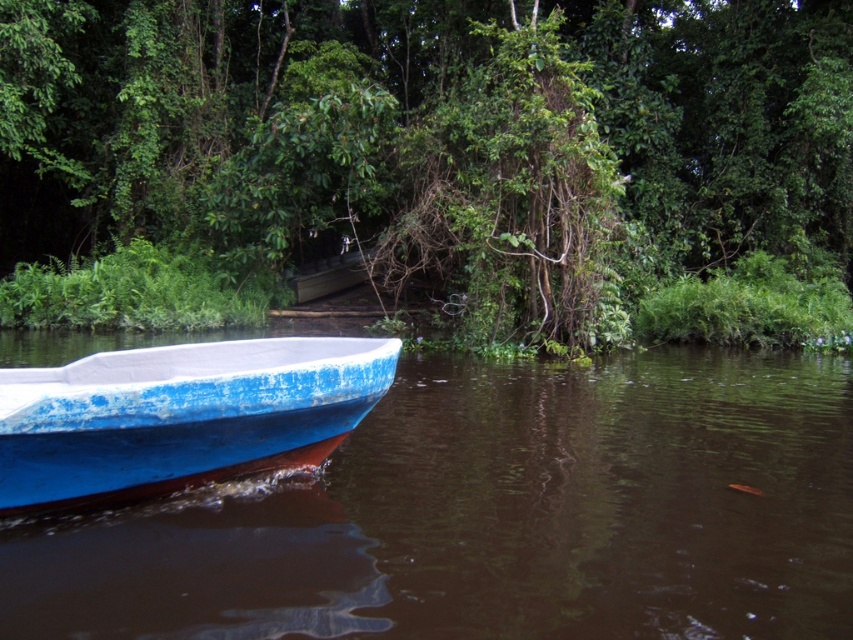
You are standing on the dock and see two boats at the lower left of the image. Which boat is closer to you, the blue painted wood boat at lower left or the blue matte boat at lower left?

The blue painted wood boat at lower left is closer to you because it is in front of the blue matte boat at lower left.

You are standing at the edge of the water and see the green leafy tree at center. If you move 0.1 units to the right along the x axis, will you be closer to the tree?

Moving 0.1 units to the right along the x axis would bring you to point 0.355 on the x axis. Since the green leafy tree at center is located at x coordinate 0.255, moving right increases the distance from the tree. Therefore, you will be farther from the green leafy tree at center.